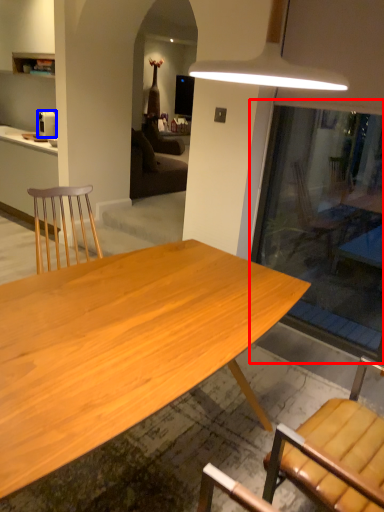
Question: Among these objects, which one is farthest to the camera, glass door (highlighted by a red box) or coffee maker (highlighted by a blue box)?

Choices:
 (A) glass door
 (B) coffee maker

Answer: (B)